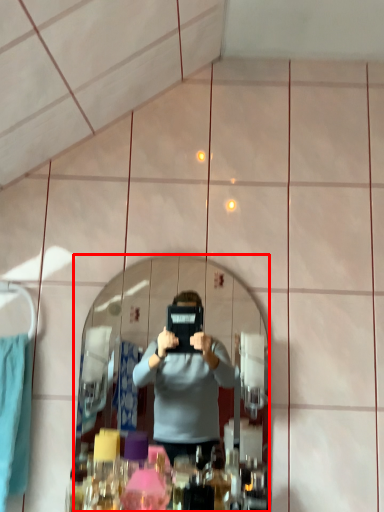
Question: From the image's perspective, where is mirror (annotated by the red box) located relative to clothe?

Choices:
 (A) below
 (B) above

Answer: (B)